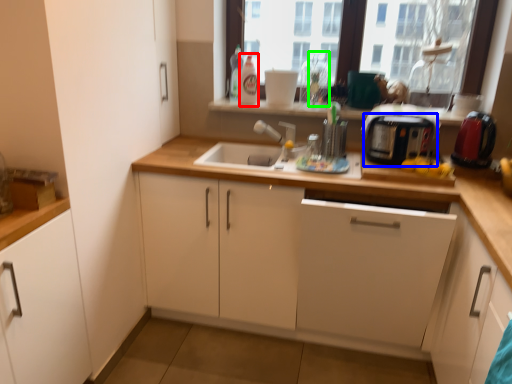
Question: Which object is positioned farthest from bottle (highlighted by a red box)? Select from toaster (highlighted by a blue box) and bottle (highlighted by a green box).

Choices:
 (A) toaster
 (B) bottle

Answer: (A)